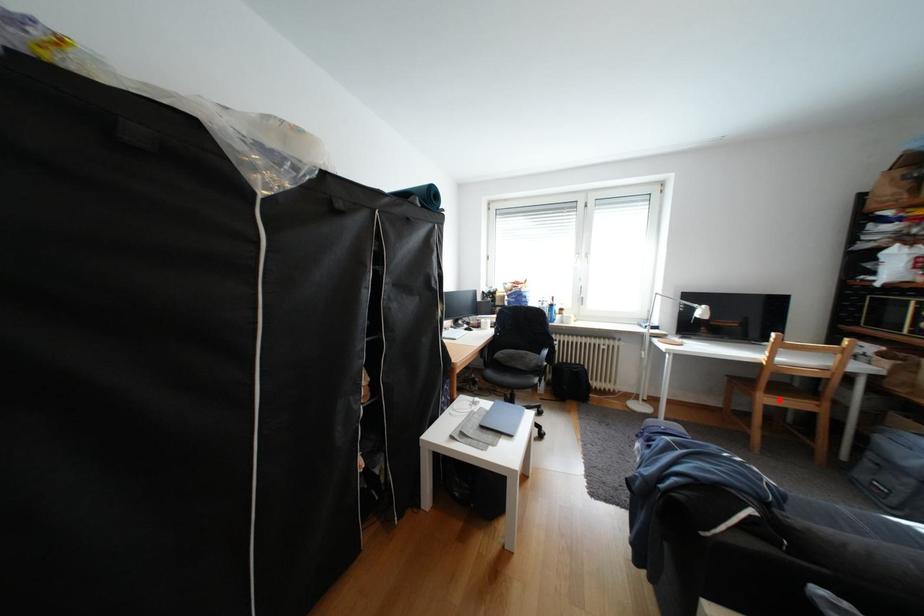
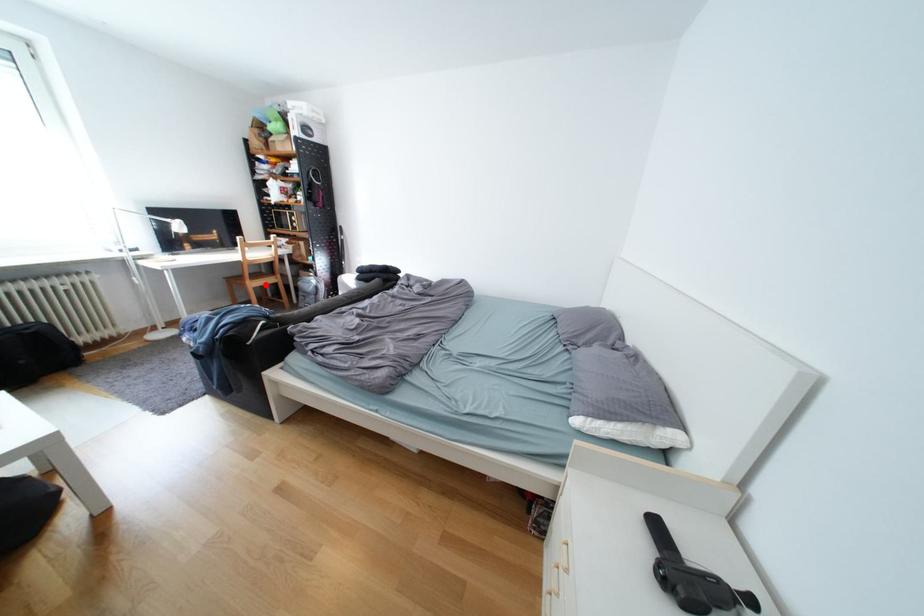
I am providing you with two images of the same scene from different viewpoints. A red point is marked on the first image and another point is marked on the second image. Does the point marked in image1 correspond to the same location as the one in image2?

Yes